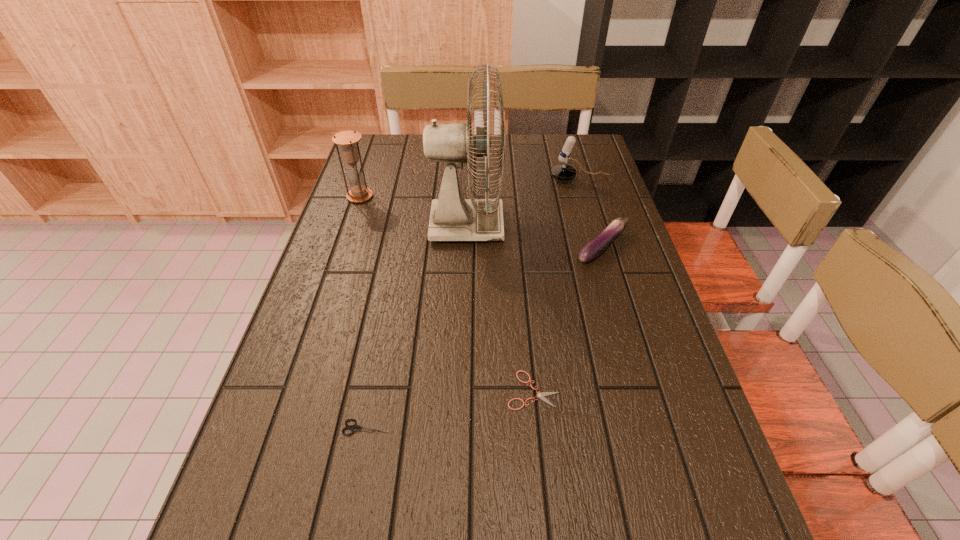
The image size is (960, 540). Find the location of `the tallest object`. the tallest object is located at coordinates (452, 218).

The image size is (960, 540). Find the location of `hourglass`. hourglass is located at coordinates (359, 192).

Identify the location of the second tallest object. (359, 192).

Identify the location of the fourth shortest object. The height and width of the screenshot is (540, 960). (563, 172).

The height and width of the screenshot is (540, 960). I want to click on the farthest object, so click(563, 172).

The height and width of the screenshot is (540, 960). What are the coordinates of `the third shortest object` in the screenshot? It's located at (595, 247).

Find the location of a particular element. The image size is (960, 540). the fifth tallest object is located at coordinates (355, 427).

The image size is (960, 540). Find the location of `the nearer shears`. the nearer shears is located at coordinates (355, 427).

Where is `the shortest object`? the shortest object is located at coordinates (540, 395).

Where is `the fifth farthest object`? The image size is (960, 540). the fifth farthest object is located at coordinates (540, 395).